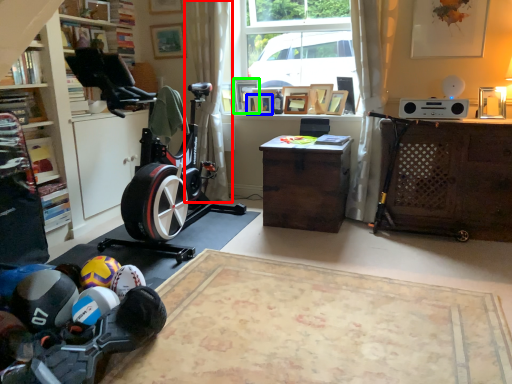
Question: Considering the real-world distances, which object is closest to curtain (highlighted by a red box)? picture frame (highlighted by a blue box) or picture frame (highlighted by a green box).

Choices:
 (A) picture frame
 (B) picture frame

Answer: (B)